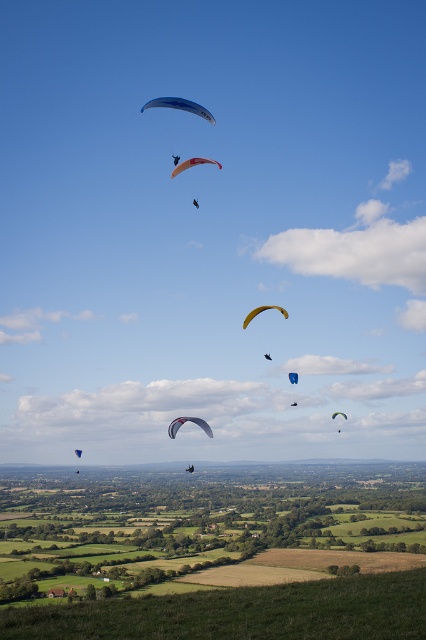
You are a pilot preparing to land your paraglider in the countryside. You see the blue fabric parachute at center in the sky. Based on its coordinates, where should you aim to land?

The blue fabric parachute at center is located at coordinates point (293,378), so you should aim to land at that position.

You are a hiker standing on the grassy hill and want to compare the two paragliders in the sky. Which one appears larger in size between the blue fabric parachute at center and the matte black paraglider at upper center?

The matte black paraglider at upper center appears larger than the blue fabric parachute at center.

You are a drone operator trying to capture footage of both the orange fabric parachute at center and the green fabric parachute at center. Your drone has a maximum camera range of 150 meters. Can your drone capture both parachutes in a single shot without moving?

The distance between the orange fabric parachute at center and the green fabric parachute at center is 166.87 meters, which exceeds the drone camera range of 150 meters. Therefore, the drone cannot capture both parachutes in a single shot without moving.